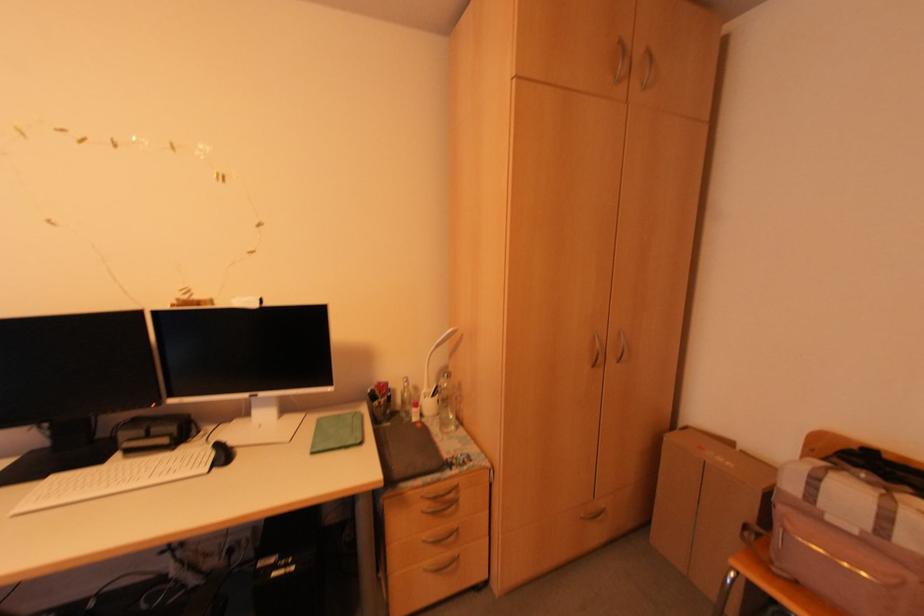
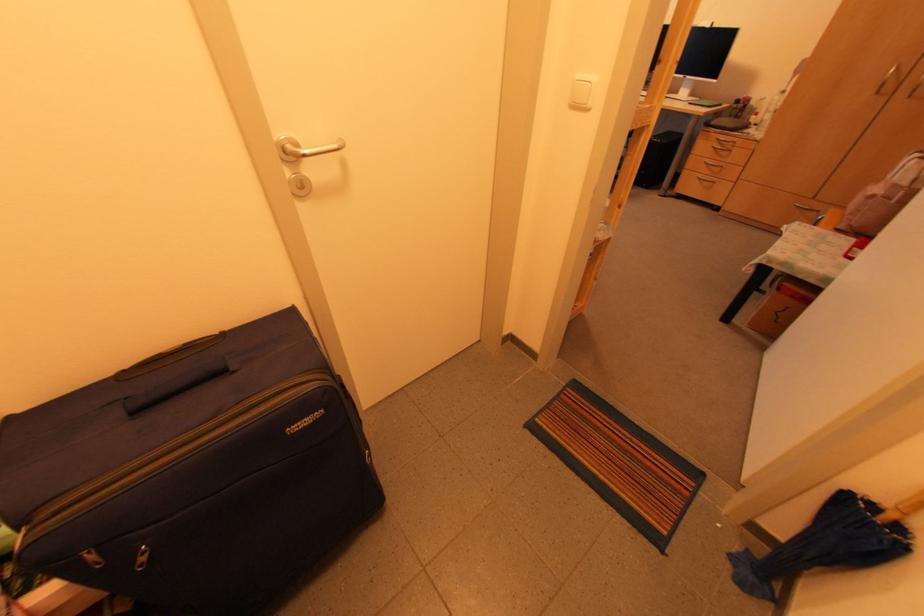
Where in the second image is the point corresponding to (600,360) from the first image?

(886, 87)